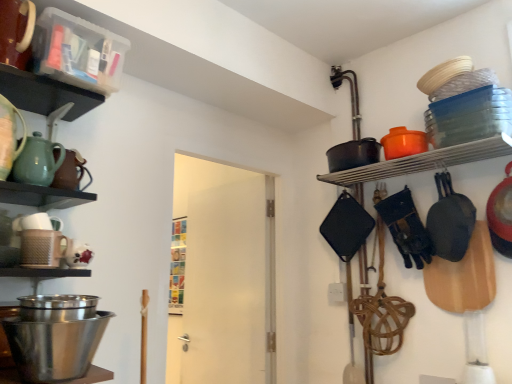
Question: Looking at the image, does clear plastic container at upper left, the first shelf positioned from the top, seem bigger or smaller compared to matte black pot at upper right, placed as the second shelf when sorted from front to back?

Choices:
 (A) big
 (B) small

Answer: (A)

Question: Is clear plastic container at upper left, the first shelf positioned from the top, in front of or behind matte black pot at upper right, placed as the second shelf when sorted from top to bottom, in the image?

Choices:
 (A) behind
 (B) front

Answer: (B)

Question: Which object is positioned closest to the polished stainless steel mixing bowl at lower left?

Choices:
 (A) matte black pot at upper right, which is the first shelf in right-to-left order
 (B) matte brown teapot at left, the 1th tea pot from the back
 (C) black matte frying pan at right
 (D) clear plastic container at upper left, arranged as the second shelf when viewed from the right
 (E) matte green teapot at left, which is the 2th tea pot in back-to-front order

Answer: (E)

Question: Which object is the farthest from the matte brown teapot at left, which is the 2th tea pot from front to back?

Choices:
 (A) polished stainless steel mixing bowl at lower left
 (B) black matte frying pan at right
 (C) matte green teapot at left, which ranks as the 1th tea pot in front-to-back order
 (D) matte black pot at upper right, placed as the first shelf when sorted from back to front
 (E) clear plastic container at upper left, arranged as the second shelf when viewed from the right

Answer: (B)